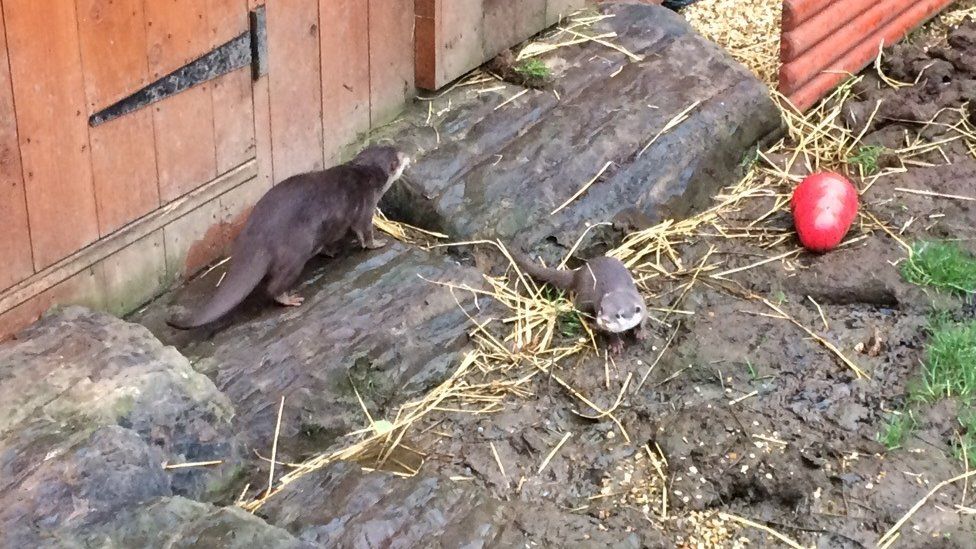
Find the location of a particular element. door is located at coordinates (158, 149).